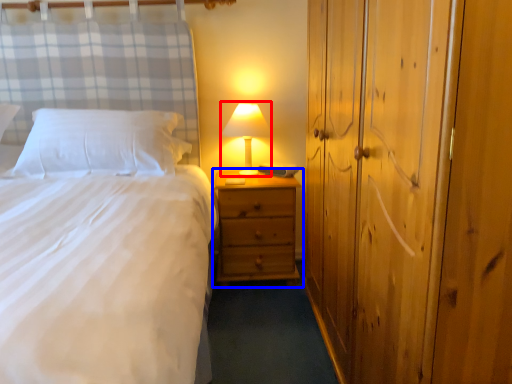
Question: Which point is closer to the camera, table lamp (highlighted by a red box) or nightstand (highlighted by a blue box)?

Choices:
 (A) table lamp
 (B) nightstand

Answer: (B)